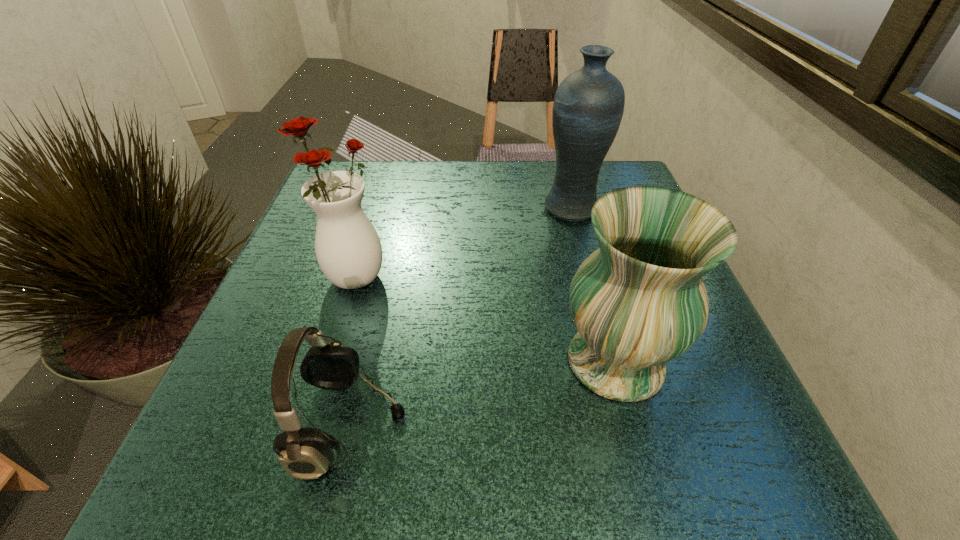
Identify which vase is the closest to the leftmost vase. Please provide its 2D coordinates. Your answer should be formatted as a tuple, i.e. [(x, y)], where the tuple contains the x and y coordinates of a point satisfying the conditions above.

[(639, 301)]

Point out which vase is positioned as the nearest to the nearest vase. Please provide its 2D coordinates. Your answer should be formatted as a tuple, i.e. [(x, y)], where the tuple contains the x and y coordinates of a point satisfying the conditions above.

[(588, 106)]

Find the location of a particular element. The image size is (960, 540). vacant area that satisfies the following two spatial constraints: 1. on the back side of the leftmost vase; 2. on the left side of the farthest vase is located at coordinates (375, 207).